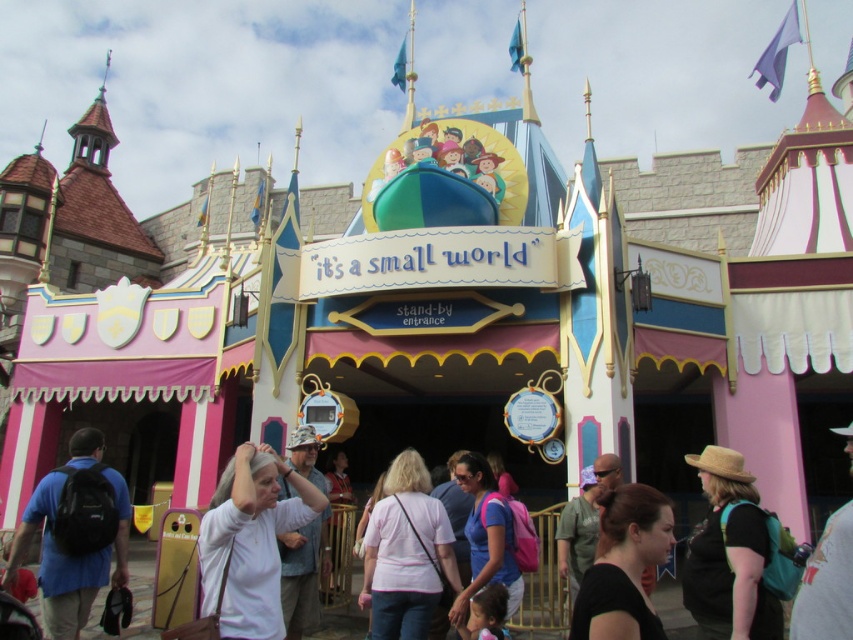
You are standing at the entrance of the It s a Small World attraction. You see a point marked at coordinates (x=729, y=556). What object is located at that point?

The point at coordinates (x=729, y=556) marks the location of the straw hat at center.